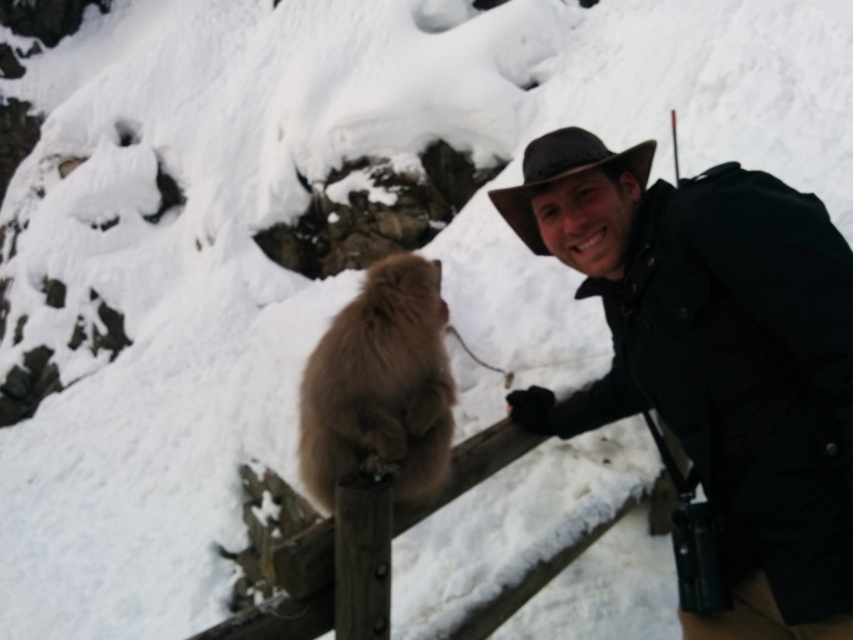
Question: Is dark brown leather hat at upper right thinner than wooden fence at center?

Choices:
 (A) no
 (B) yes

Answer: (A)

Question: Based on their relative distances, which object is farther from the brown felt hat at upper right?

Choices:
 (A) wooden fence at center
 (B) fuzzy brown monkey at center

Answer: (A)

Question: Which object appears closest to the camera in this image?

Choices:
 (A) dark brown leather hat at upper right
 (B) fuzzy brown monkey at center
 (C) brown felt hat at upper right
 (D) wooden fence at center

Answer: (A)

Question: In this image, where is wooden fence at center located relative to brown felt hat at upper right?

Choices:
 (A) right
 (B) left

Answer: (B)

Question: Which point is closer to the camera taking this photo?

Choices:
 (A) (666, 378)
 (B) (579, 138)
 (C) (317, 573)
 (D) (396, 262)

Answer: (C)

Question: Does dark brown leather hat at upper right appear on the left side of brown felt hat at upper right?

Choices:
 (A) no
 (B) yes

Answer: (A)